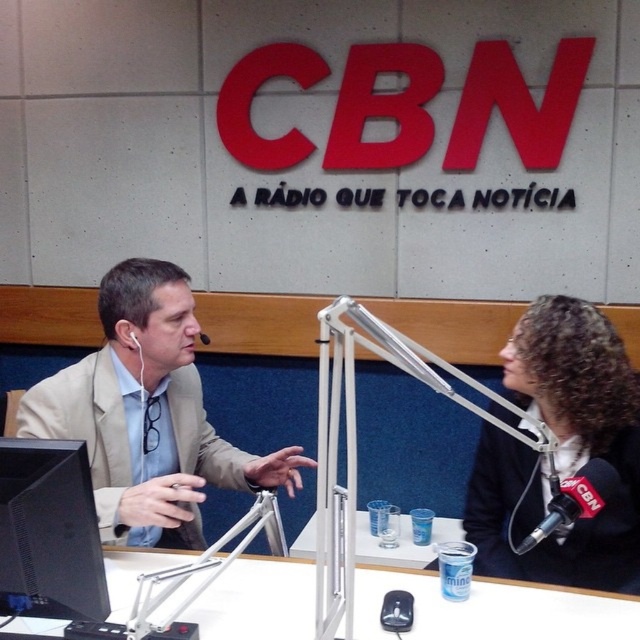
Question: Among these points, which one is nearest to the camera?

Choices:
 (A) (83, 572)
 (B) (131, 332)
 (C) (138, 468)

Answer: (A)

Question: Is curly hair black blazer at right in front of white plastic table at center?

Choices:
 (A) no
 (B) yes

Answer: (A)

Question: Considering the relative positions of white plastic table at center and black plastic monitor at lower left in the image provided, where is white plastic table at center located with respect to black plastic monitor at lower left?

Choices:
 (A) above
 (B) below

Answer: (B)

Question: Which object appears farthest from the camera in this image?

Choices:
 (A) white earphone at left
 (B) black metallic microphone at center
 (C) black plastic monitor at lower left

Answer: (B)

Question: Can you confirm if black plastic monitor at lower left is wider than white earphone at left?

Choices:
 (A) yes
 (B) no

Answer: (A)

Question: Which is farther from the white earphone at left?

Choices:
 (A) black plastic monitor at lower left
 (B) curly hair black blazer at right
 (C) beige fabric suit at left
 (D) white plastic table at center

Answer: (B)